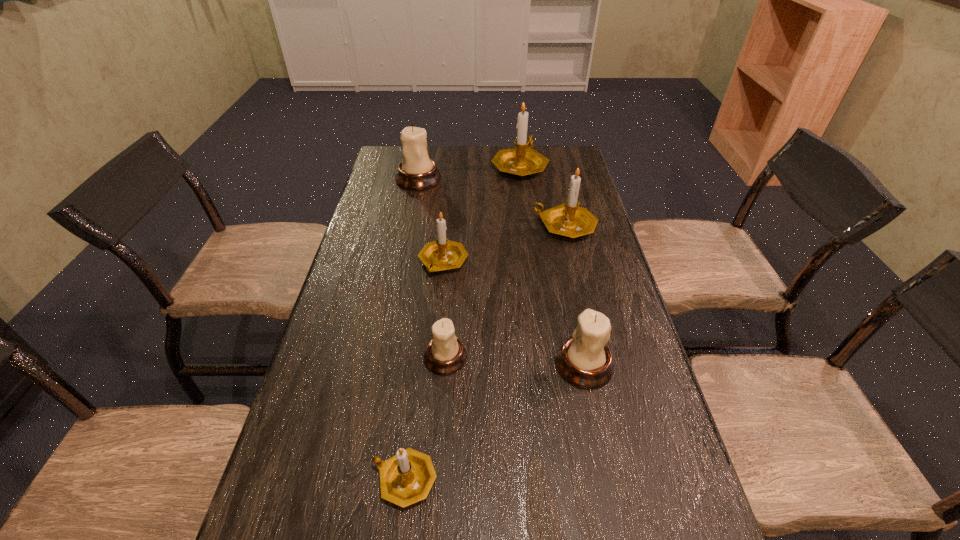
Identify the location of object that is the third closest to the second biggest gold candle holder. (416, 171).

Where is `candle holder that can be found as the fifth closest to the third smallest gold candle holder`? candle holder that can be found as the fifth closest to the third smallest gold candle holder is located at coordinates (445, 354).

Locate an element on the screen. candle holder that is the fifth closest to the second biggest gold candle holder is located at coordinates tap(445, 354).

Where is `gold candle holder that stands as the third closest to the second white candle holder from right to left`? This screenshot has width=960, height=540. gold candle holder that stands as the third closest to the second white candle holder from right to left is located at coordinates (567, 219).

Point out which gold candle holder is positioned as the third nearest to the nearest candle holder. Please provide its 2D coordinates. Your answer should be formatted as a tuple, i.e. [(x, y)], where the tuple contains the x and y coordinates of a point satisfying the conditions above.

[(523, 160)]

Select which white candle holder appears as the closest to the third smallest gold candle holder. Please provide its 2D coordinates. Your answer should be formatted as a tuple, i.e. [(x, y)], where the tuple contains the x and y coordinates of a point satisfying the conditions above.

[(416, 171)]

At what (x,y) coordinates should I click in order to perform the action: click on the second closest white candle holder to the third biggest gold candle holder. Please return your answer as a coordinate pair (x, y). The height and width of the screenshot is (540, 960). Looking at the image, I should click on (584, 360).

This screenshot has height=540, width=960. In order to click on free space that satisfies the following two spatial constraints: 1. on the back side of the second smallest gold candle holder; 2. on the right side of the third smallest gold candle holder in this screenshot , I will do `click(446, 226)`.

Identify the location of vacant region that satisfies the following two spatial constraints: 1. on the front side of the second smallest gold candle holder; 2. on the right side of the leftmost white candle holder. (402, 261).